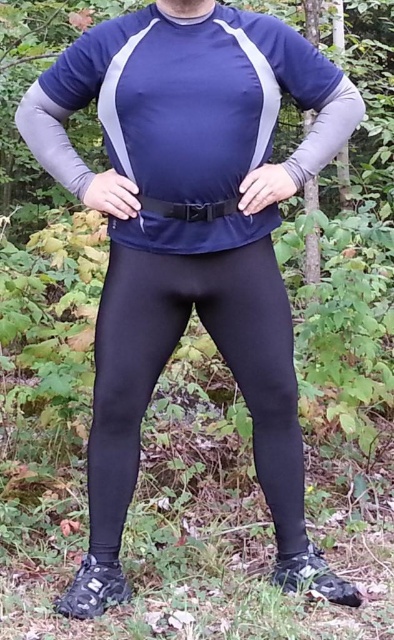
Between black matte leggings at center and black matte belt at center, which one has less height?

With less height is black matte belt at center.

Based on the photo, which is above, black matte leggings at center or black matte belt at center?

black matte belt at center is higher up.

You are a GUI agent. You are given a task and a screenshot of the screen. Output one action in this format:
    pyautogui.click(x=<x>, y=<y>)
    Task: Click on the black matte leggings at center
    This screenshot has width=394, height=640.
    Given the screenshot: What is the action you would take?
    pyautogui.click(x=167, y=360)